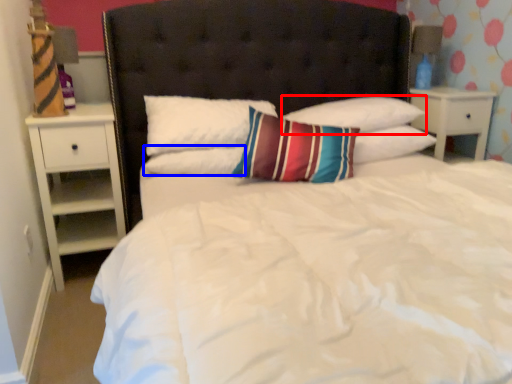
Question: Which of the following is the closest to the observer, pillow (highlighted by a red box) or pillow (highlighted by a blue box)?

Choices:
 (A) pillow
 (B) pillow

Answer: (B)